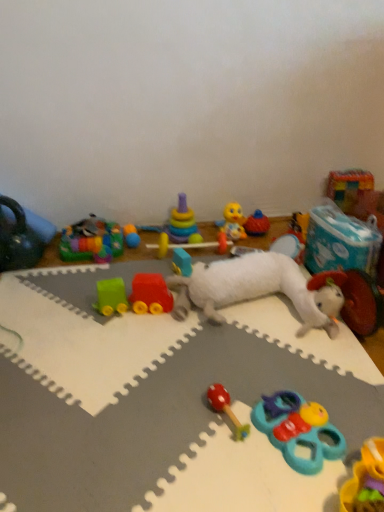
Where is `empty space that is in between blue rubber toy at lower right, arranged as the eleventh toy when viewed from the left, and smooth red wooden rattle at center, which ranks as the 7th toy in left-to-right order`? empty space that is in between blue rubber toy at lower right, arranged as the eleventh toy when viewed from the left, and smooth red wooden rattle at center, which ranks as the 7th toy in left-to-right order is located at coordinates (260, 431).